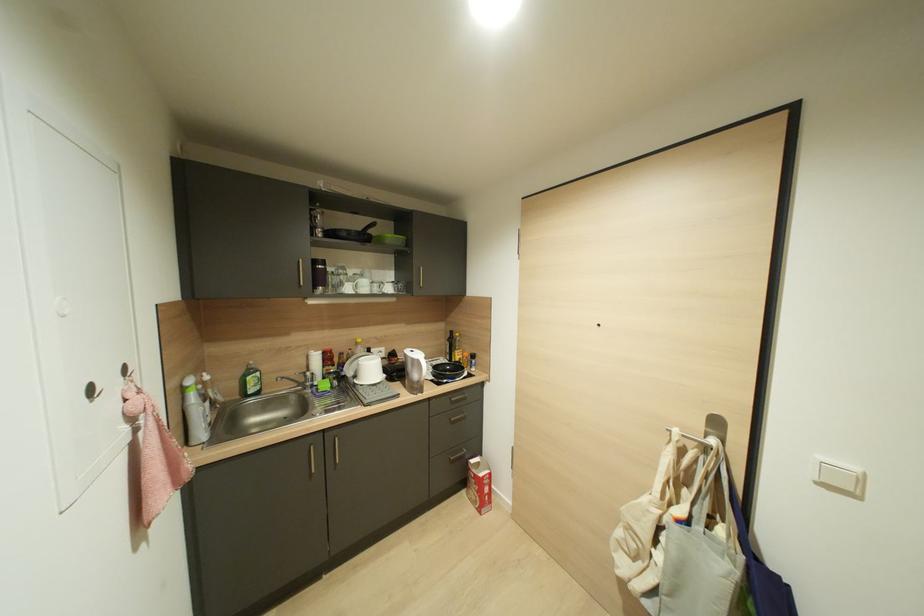
You are a GUI agent. You are given a task and a screenshot of the screen. Output one action in this format:
    pyautogui.click(x=<x>, y=<y>)
    Task: Click on the green bottle pump
    This screenshot has width=924, height=616.
    Given the screenshot: What is the action you would take?
    pyautogui.click(x=249, y=381)